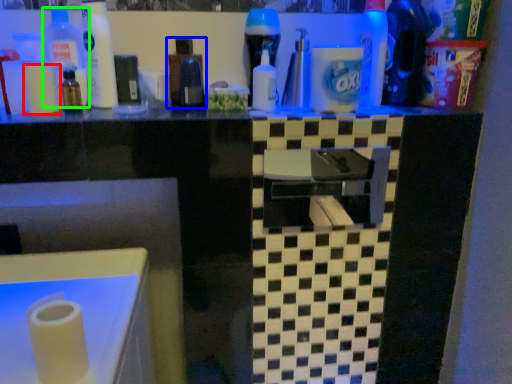
Question: Estimate the real-world distances between objects in this image. Which object is closer to toilet paper (highlighted by a red box), bottle (highlighted by a blue box) or bottle (highlighted by a green box)?

Choices:
 (A) bottle
 (B) bottle

Answer: (B)